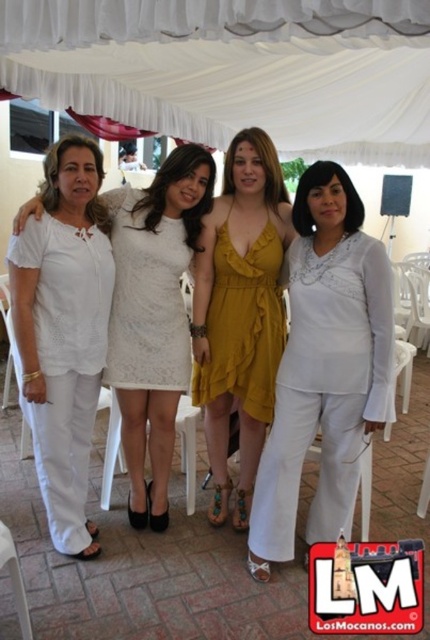
Question: Is white lace dress at center wider than mustard yellow fabric dress at center?

Choices:
 (A) no
 (B) yes

Answer: (B)

Question: Which object appears closest to the camera in this image?

Choices:
 (A) white satin dress at center
 (B) yellow fabric dress at center
 (C) white lace dress at center

Answer: (A)

Question: Can you confirm if white satin dress at center is positioned below yellow fabric dress at center?

Choices:
 (A) yes
 (B) no

Answer: (A)

Question: Can you confirm if white matte pants at center is wider than mustard yellow fabric dress at center?

Choices:
 (A) no
 (B) yes

Answer: (A)

Question: Based on their relative distances, which object is nearer to the white lace dress at center?

Choices:
 (A) yellow fabric dress at center
 (B) white satin dress at center
 (C) mustard yellow fabric dress at center

Answer: (A)

Question: Among these objects, which one is nearest to the camera?

Choices:
 (A) white lace dress at center
 (B) mustard yellow fabric dress at center
 (C) yellow fabric dress at center
 (D) white fabric canopy at upper center

Answer: (A)